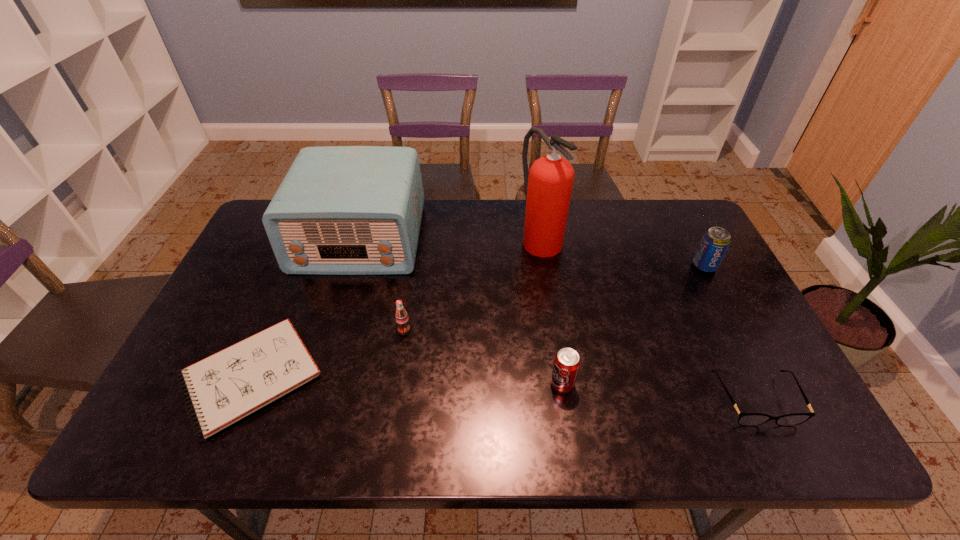
I want to click on object that can be found as the closest to the fire extinguisher, so click(340, 210).

Identify which soda is the closest to the second soda from left to right. Please provide its 2D coordinates. Your answer should be formatted as a tuple, i.e. [(x, y)], where the tuple contains the x and y coordinates of a point satisfying the conditions above.

[(401, 316)]

Identify the location of the closest soda to the shortest object. (401, 316).

Where is `free space that satisfies the following two spatial constraints: 1. on the front panel of the second tallest object; 2. on the right side of the rightmost soda`? Image resolution: width=960 pixels, height=540 pixels. free space that satisfies the following two spatial constraints: 1. on the front panel of the second tallest object; 2. on the right side of the rightmost soda is located at coordinates (351, 266).

This screenshot has width=960, height=540. What are the coordinates of `vacant space that satisfies the following two spatial constraints: 1. on the front panel of the radio receiver; 2. on the left side of the second soda from left to right` in the screenshot? It's located at (317, 384).

Find the location of a particular element. vacant region that satisfies the following two spatial constraints: 1. on the front panel of the radio receiver; 2. on the left side of the second nearest soda is located at coordinates 332,330.